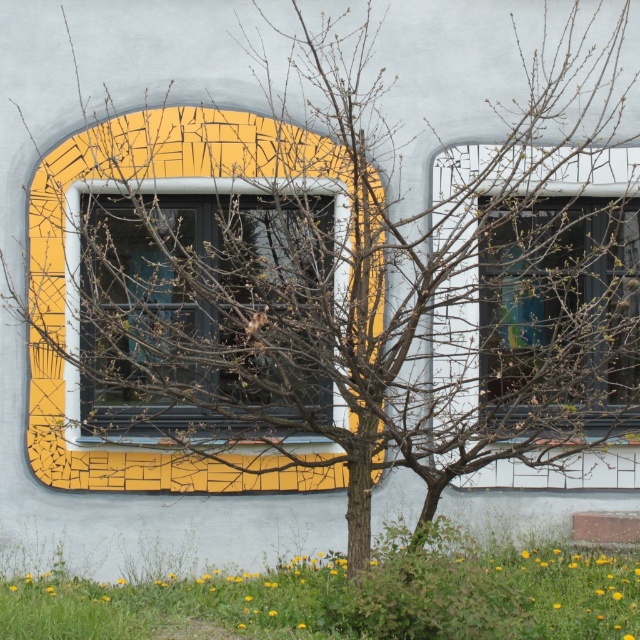
Is yellow mosaic tile at center wider than matte glass window at center?

Correct, the width of yellow mosaic tile at center exceeds that of matte glass window at center.

Who is lower down, yellow mosaic tile at center or matte glass window at center?

yellow mosaic tile at center is below.

You are a GUI agent. You are given a task and a screenshot of the screen. Output one action in this format:
    pyautogui.click(x=<x>, y=<y>)
    Task: Click on the yellow mosaic tile at center
    This screenshot has height=640, width=640.
    Given the screenshot: What is the action you would take?
    pyautogui.click(x=156, y=298)

You are a GUI agent. You are given a task and a screenshot of the screen. Output one action in this format:
    pyautogui.click(x=<x>, y=<y>)
    Task: Click on the yellow mosaic tile at center
    
    Given the screenshot: What is the action you would take?
    pyautogui.click(x=156, y=298)

Does matte glass window at center appear on the left side of transparent glass window at center?

Indeed, matte glass window at center is positioned on the left side of transparent glass window at center.

At what (x,y) coordinates should I click in order to perform the action: click on matte glass window at center. Please return your answer as a coordinate pair (x, y). Looking at the image, I should click on (189, 307).

Which is behind, point (81, 205) or point (556, 262)?

Point (81, 205)

This screenshot has width=640, height=640. Identify the location of matte glass window at center. (189, 307).

What do you see at coordinates (156, 298) in the screenshot? I see `yellow mosaic tile at center` at bounding box center [156, 298].

Looking at this image, does yellow mosaic tile at center appear over transparent glass window at center?

No, yellow mosaic tile at center is not above transparent glass window at center.

Find the location of `yellow mosaic tile at center`. yellow mosaic tile at center is located at coordinates (156, 298).